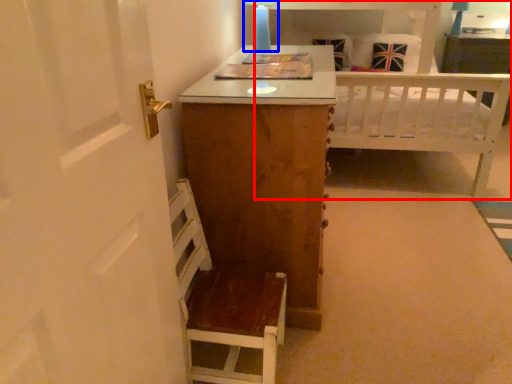
Question: Which point is further to the camera, bed (highlighted by a red box) or table lamp (highlighted by a blue box)?

Choices:
 (A) bed
 (B) table lamp

Answer: (A)